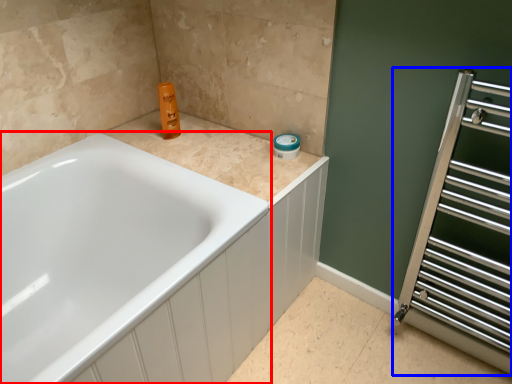
Question: Which of the following is the farthest to the observer, bathtub (highlighted by a red box) or screen door (highlighted by a blue box)?

Choices:
 (A) bathtub
 (B) screen door

Answer: (B)